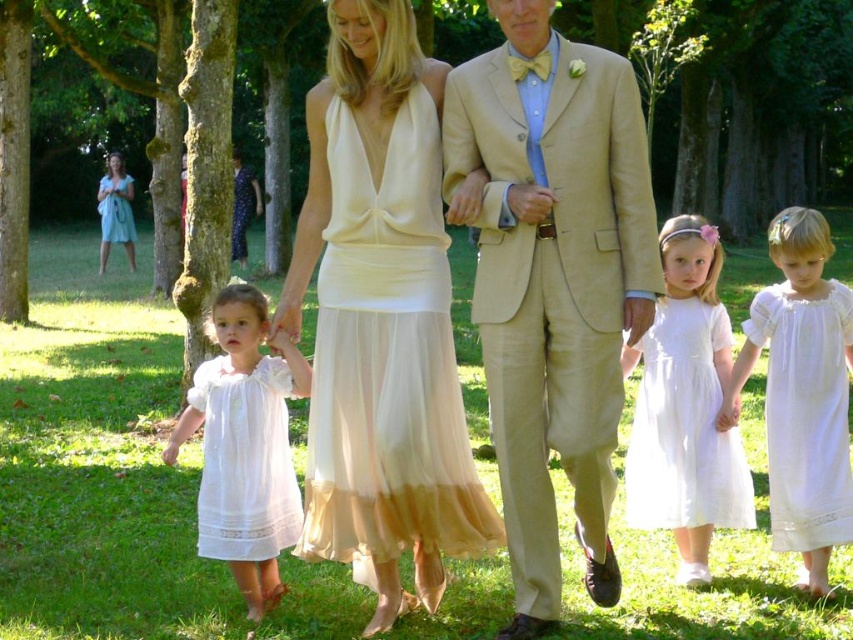
Question: Based on their relative distances, which object is farther from the white lace dress at left?

Choices:
 (A) beige linen suit at center
 (B) white lace dress at center
 (C) matte cream chiffon dress at center

Answer: (B)

Question: Which object appears closest to the camera in this image?

Choices:
 (A) matte blue dress at upper left
 (B) matte cream chiffon dress at center
 (C) white lace dress at lower right

Answer: (B)

Question: Which of the following is the closest to the observer?

Choices:
 (A) matte cream chiffon dress at center
 (B) white lace dress at left
 (C) beige linen suit at center

Answer: (C)

Question: Is white lace dress at center bigger than white lace dress at lower left?

Choices:
 (A) yes
 (B) no

Answer: (A)

Question: Can you confirm if beige linen suit at center is positioned above matte blue dress at upper left?

Choices:
 (A) yes
 (B) no

Answer: (B)

Question: Is white lace dress at center in front of white lace dress at lower right?

Choices:
 (A) no
 (B) yes

Answer: (A)